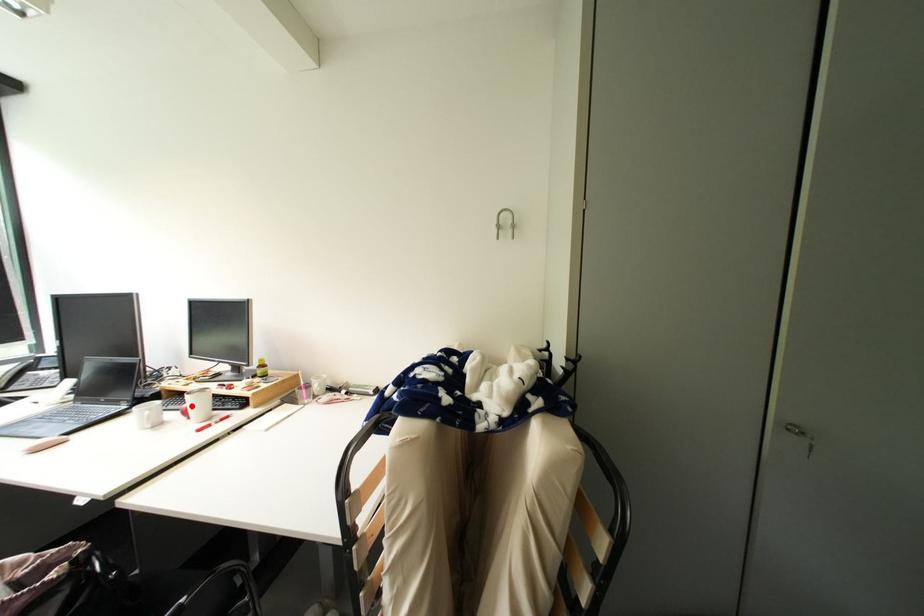
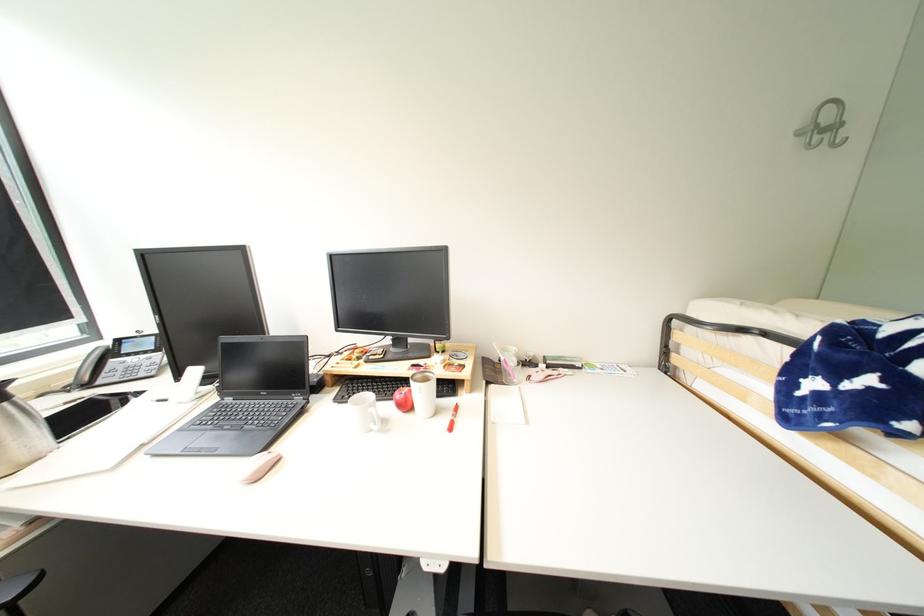
Where in the second image is the point corresponding to the highlighted location from the first image?

(405, 397)